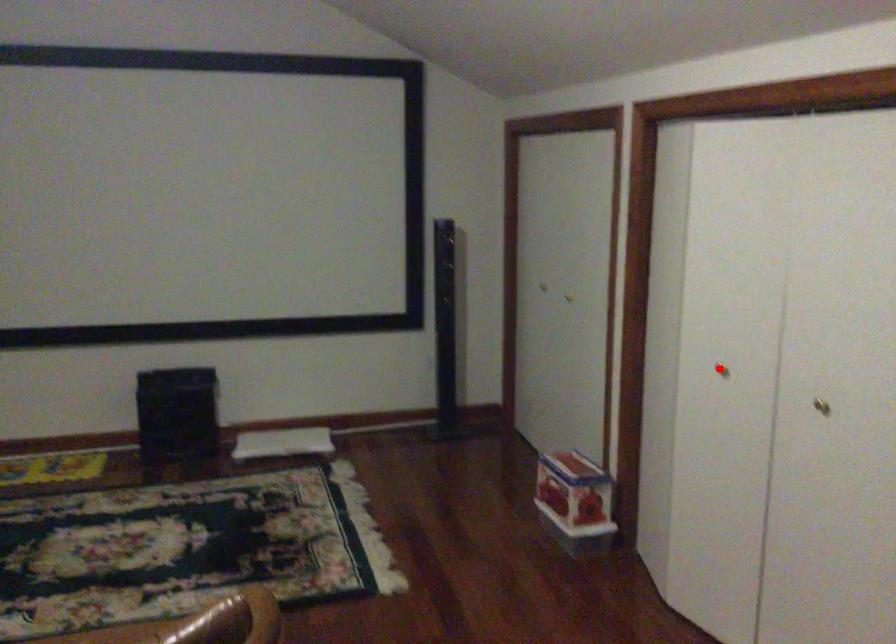
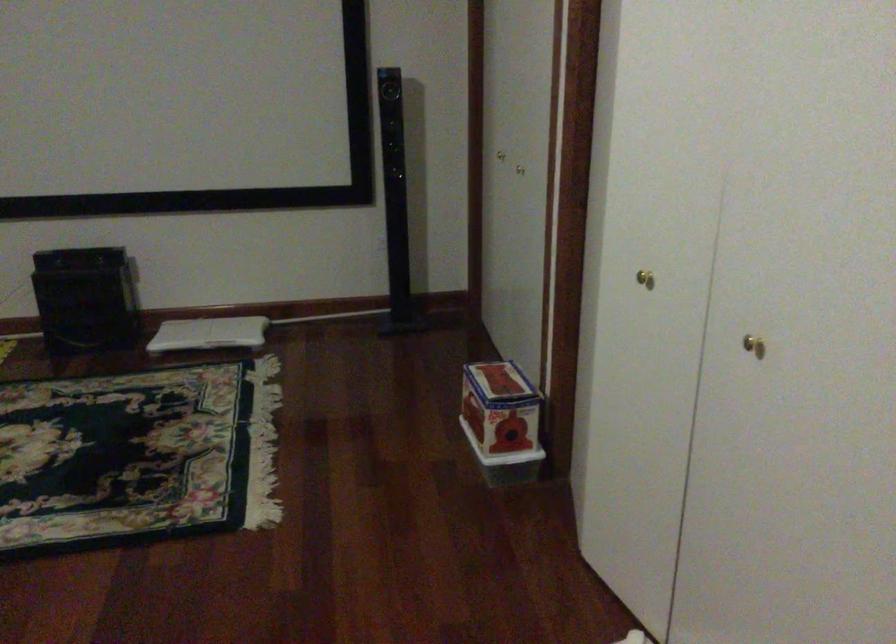
The point at the highlighted location is marked in the first image. Where is the corresponding point in the second image?

(644, 279)